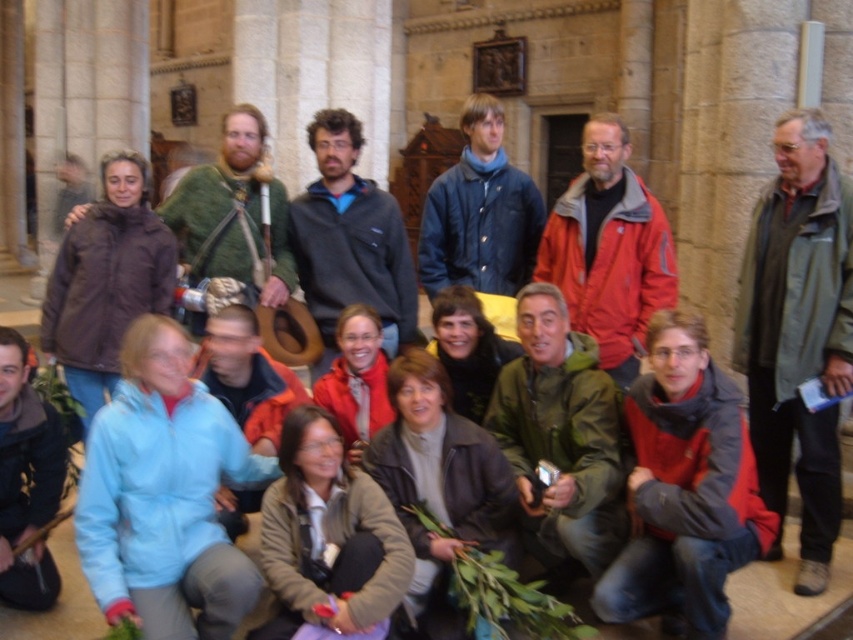
Question: Which of the following is the closest to the observer?

Choices:
 (A) (473, 230)
 (B) (608, 356)
 (C) (18, 486)
 (D) (248, 154)

Answer: (C)

Question: Based on their relative distances, which object is farther from the blue matte jacket at center?

Choices:
 (A) green matte jacket at center
 (B) matte red jacket at center
 (C) green wool sweater at center
 (D) light blue fabric jacket at lower left

Answer: (D)

Question: Is green matte jacket at right below green wool sweater at center?

Choices:
 (A) no
 (B) yes

Answer: (B)

Question: Which point is farther from the camera taking this photo?

Choices:
 (A) (279, 218)
 (B) (376, 196)
 (C) (509, 273)

Answer: (C)

Question: Is green matte jacket at center wider than light blue fabric jacket at lower left?

Choices:
 (A) no
 (B) yes

Answer: (A)

Question: Is green wool sweater at center above light blue fabric jacket at lower left?

Choices:
 (A) yes
 (B) no

Answer: (A)